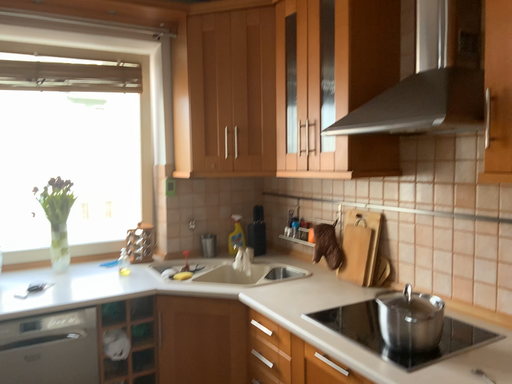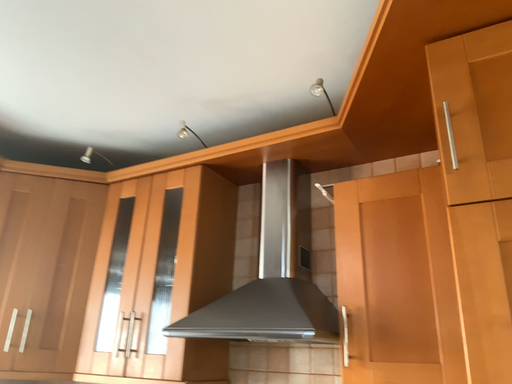
Question: How did the camera likely rotate when shooting the video?

Choices:
 (A) rotated upward
 (B) rotated downward

Answer: (A)